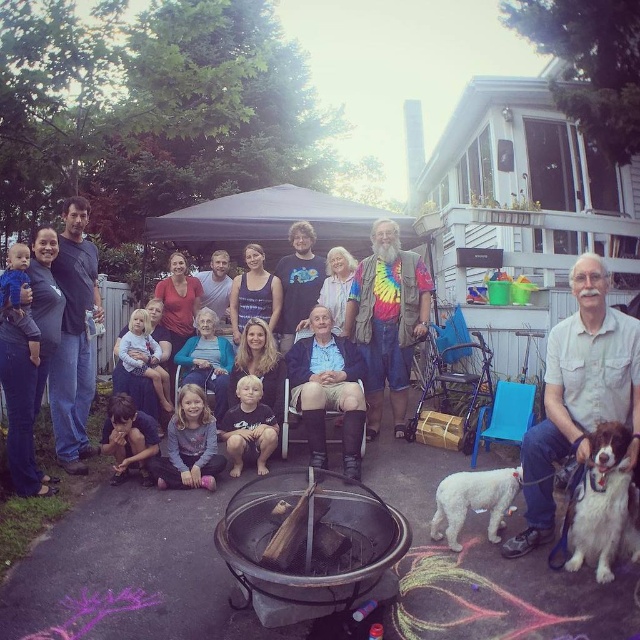
Question: Which of these objects is positioned farthest from the white shirt at center?

Choices:
 (A) dark blue shirt at lower left
 (B) white fluffy dog at lower right
 (C) multicolored tie-dye shirt at center

Answer: (A)

Question: Estimate the real-world distances between objects in this image. Which object is farther from the black metal fire pit at center?

Choices:
 (A) multicolored tie-dye shirt at center
 (B) blonde hair boy at center

Answer: (A)

Question: Is black metal fire pit at center to the left of multicolored tie-dye shirt at center from the viewer's perspective?

Choices:
 (A) no
 (B) yes

Answer: (B)

Question: Does blue fabric shirt at center have a greater width compared to gray fleece jacket at lower center?

Choices:
 (A) yes
 (B) no

Answer: (A)

Question: Can you confirm if multicolored tie-dye shirt at center is positioned to the right of white fluffy dog at lower right?

Choices:
 (A) yes
 (B) no

Answer: (B)

Question: Which point is closer to the camera?

Choices:
 (A) black metal fire pit at center
 (B) white fur dog at lower right
 (C) white shirt at center

Answer: (A)